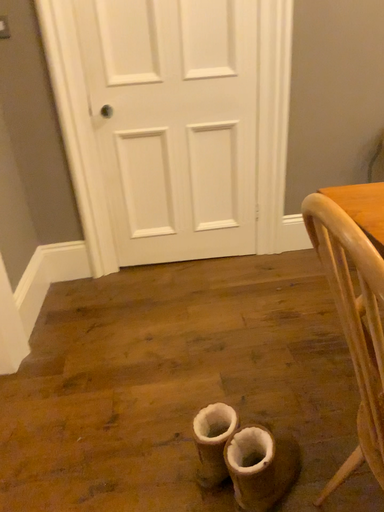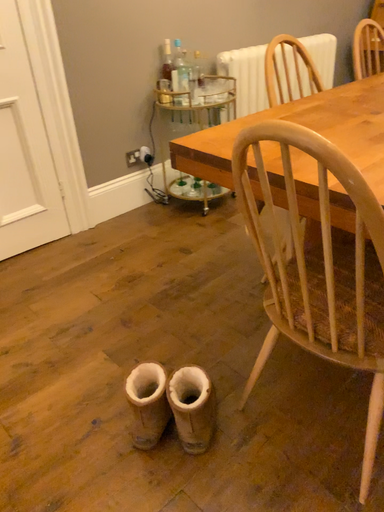
Question: Which way did the camera rotate in the video?

Choices:
 (A) rotated left
 (B) rotated right

Answer: (B)